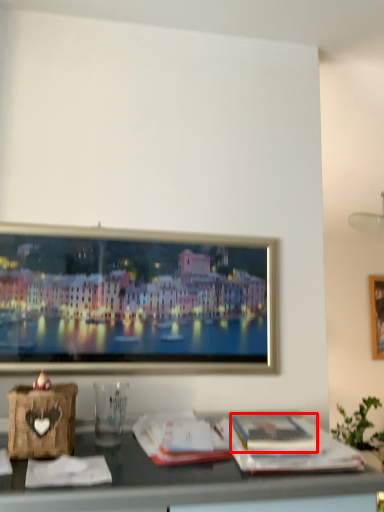
Question: In this image, where is magazine (annotated by the red box) located relative to magazine?

Choices:
 (A) right
 (B) left

Answer: (A)